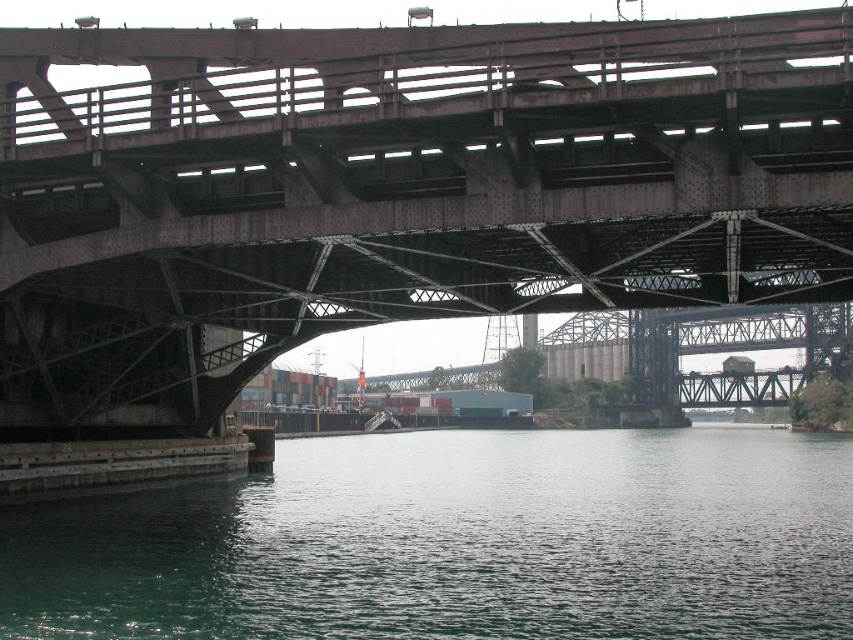
Is rusty metal bridge at upper center wider than green water at lower center?

No.

Who is higher up, rusty metal bridge at upper center or green water at lower center?

rusty metal bridge at upper center is higher up.

Find the location of `rusty metal bridge at upper center`. rusty metal bridge at upper center is located at coordinates (399, 188).